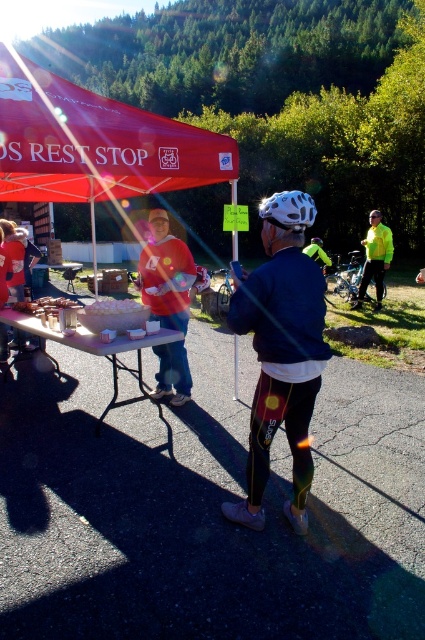
Question: Which point is closer to the camera?

Choices:
 (A) (380, 304)
 (B) (176, 378)
 (C) (73, 269)
 (D) (328, 352)

Answer: (D)

Question: Does white plastic table at center appear on the left side of neon yellow jacket at center?

Choices:
 (A) yes
 (B) no

Answer: (A)

Question: Among these objects, which one is nearest to the camera?

Choices:
 (A) neon green jersey at center
 (B) matte black helmet at center

Answer: (B)

Question: Which point is farther to the camera?

Choices:
 (A) shiny silver helmet at center
 (B) white paper plates at center
 (C) white plastic table at center
 (D) white paper bag at center

Answer: (A)

Question: Is white plastic table at center above white matte bicycle helmet at center?

Choices:
 (A) no
 (B) yes

Answer: (A)

Question: Does white plastic table at center have a smaller size compared to white plastic picnic table at center?

Choices:
 (A) no
 (B) yes

Answer: (A)